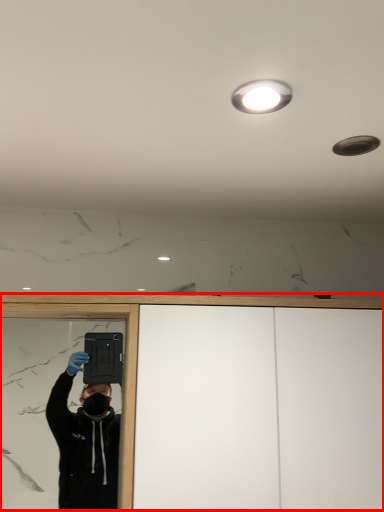
Question: From the image's perspective, where is dresser (annotated by the red box) located in relation to droplight in the image?

Choices:
 (A) above
 (B) below

Answer: (B)